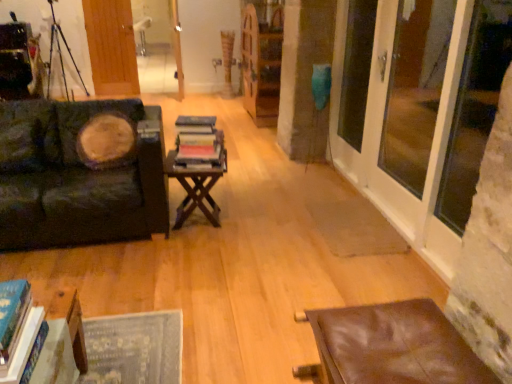
This screenshot has height=384, width=512. What are the coordinates of `space that is in front of transparent glass door at right, the 2th window screen positioned from the front` in the screenshot? It's located at (376, 248).